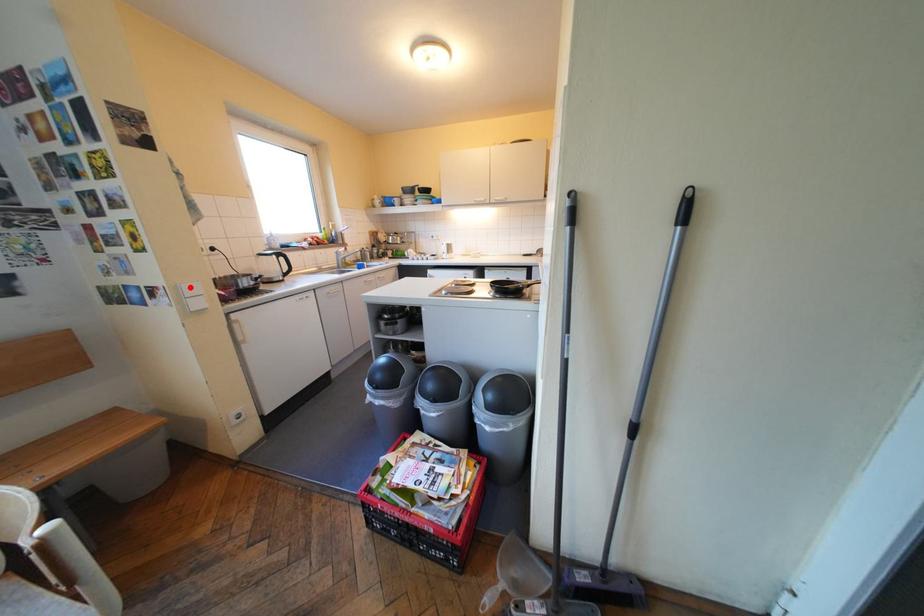
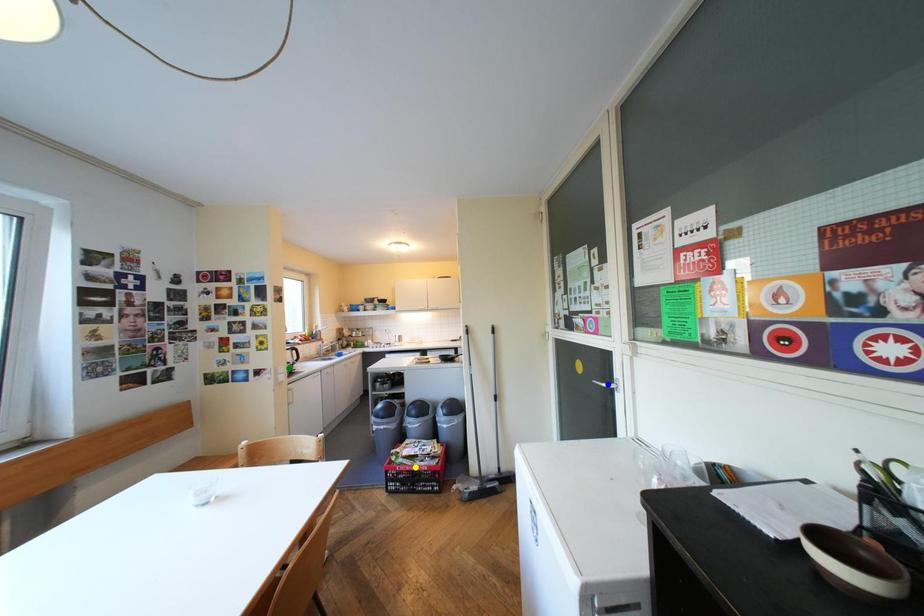
Question: I am providing you with two images of the same scene from different viewpoints. A red point is marked on the first image. You are given multiple points on the second image. Which point in image 2 represents the same 3d spot as the red point in image 1?

Choices:
 (A) blue point
 (B) yellow point
 (C) green point

Answer: (C)